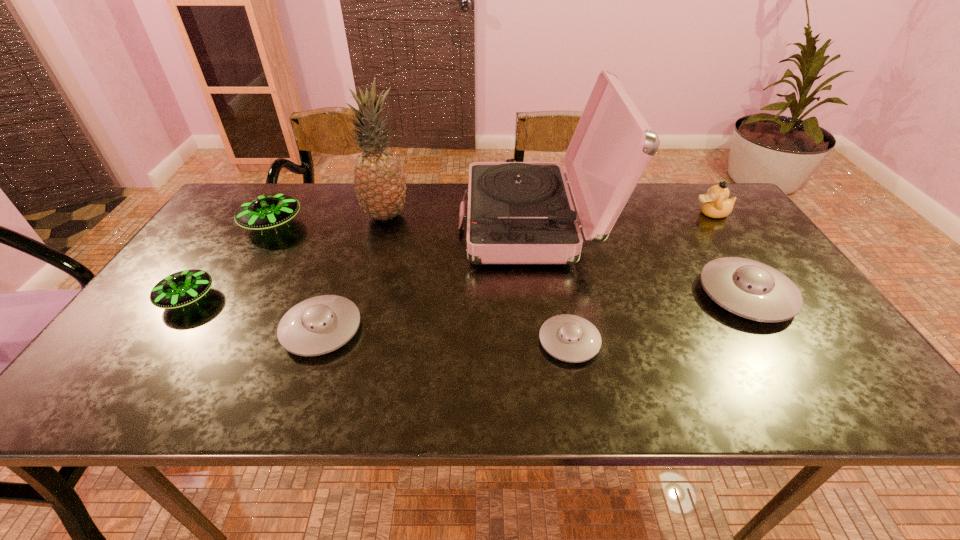
Identify the location of saucer that is at the right edge. (748, 288).

Identify the location of object present at the far left corner. (268, 211).

Where is `object that is at the far right corner`? Image resolution: width=960 pixels, height=540 pixels. object that is at the far right corner is located at coordinates (716, 204).

Find the location of `free spot at the far edge of the desktop`. free spot at the far edge of the desktop is located at coordinates (653, 200).

I want to click on free space at the near edge of the desktop, so click(x=444, y=404).

In the image, there is a desktop. Where is `vacant space at the left edge`? The image size is (960, 540). vacant space at the left edge is located at coordinates (197, 307).

In the image, there is a desktop. At what (x,y) coordinates should I click in order to perform the action: click on free space at the right edge. Please return your answer as a coordinate pair (x, y). This screenshot has width=960, height=540. Looking at the image, I should click on (809, 345).

Where is `free space at the far right corner`? free space at the far right corner is located at coordinates (688, 192).

At what (x,y) coordinates should I click in order to perform the action: click on empty space that is in between the pineapple and the fourth tallest object. Please return your answer as a coordinate pair (x, y). This screenshot has height=540, width=960. Looking at the image, I should click on (329, 220).

The image size is (960, 540). What are the coordinates of `unoccupied area between the duckling and the second saucer from right to left` in the screenshot? It's located at (640, 278).